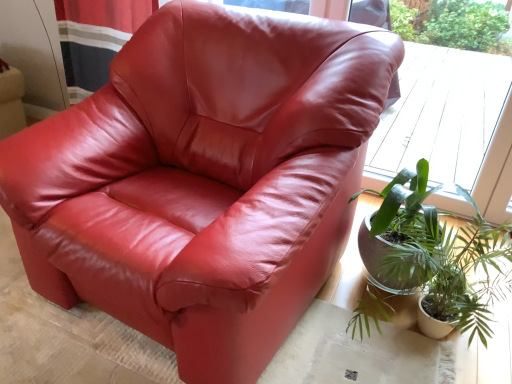
I want to click on vacant region to the left of green leafy plant at lower right, so click(323, 343).